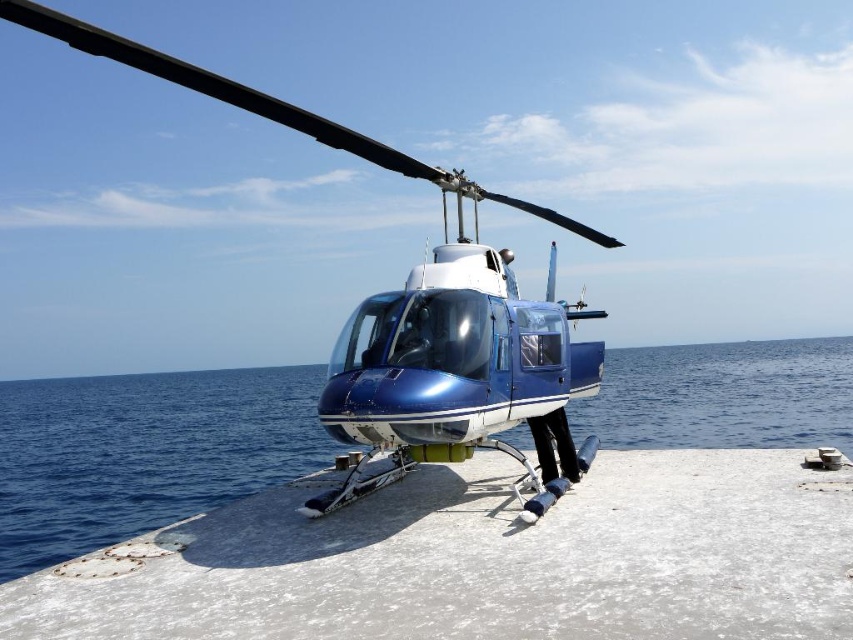
Question: Does concrete ledge at center appear on the right side of blue glossy water at center?

Choices:
 (A) no
 (B) yes

Answer: (A)

Question: Can you confirm if blue glossy water at center is thinner than metallic blue helicopter at center?

Choices:
 (A) no
 (B) yes

Answer: (A)

Question: Which object is the farthest from the concrete ledge at center?

Choices:
 (A) blue glossy water at center
 (B) metallic blue helicopter at center

Answer: (A)

Question: Estimate the real-world distances between objects in this image. Which object is farther from the concrete ledge at center?

Choices:
 (A) blue glossy water at center
 (B) metallic blue helicopter at center

Answer: (A)

Question: Can you confirm if concrete ledge at center is positioned below blue glossy water at center?

Choices:
 (A) yes
 (B) no

Answer: (B)

Question: Which point is farther to the camera?

Choices:
 (A) concrete ledge at center
 (B) metallic blue helicopter at center
 (C) blue glossy water at center

Answer: (C)